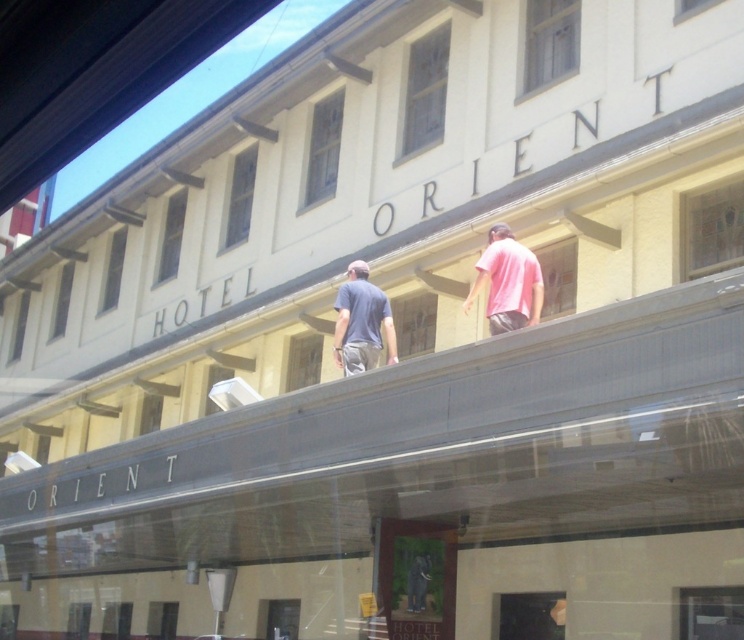
Question: Is pink matte shirt at upper right below dark blue t-shirt at center?

Choices:
 (A) yes
 (B) no

Answer: (B)

Question: Is pink matte shirt at upper right positioned before dark blue t-shirt at center?

Choices:
 (A) yes
 (B) no

Answer: (A)

Question: Which object is farther from the camera taking this photo?

Choices:
 (A) dark blue t-shirt at center
 (B) pink matte shirt at upper right

Answer: (A)

Question: Does pink matte shirt at upper right have a lesser width compared to dark blue t-shirt at center?

Choices:
 (A) yes
 (B) no

Answer: (B)

Question: Which object is farther from the camera taking this photo?

Choices:
 (A) pink matte shirt at upper right
 (B) dark blue t-shirt at center

Answer: (B)

Question: Which object appears closest to the camera in this image?

Choices:
 (A) dark blue t-shirt at center
 (B) pink matte shirt at upper right

Answer: (B)